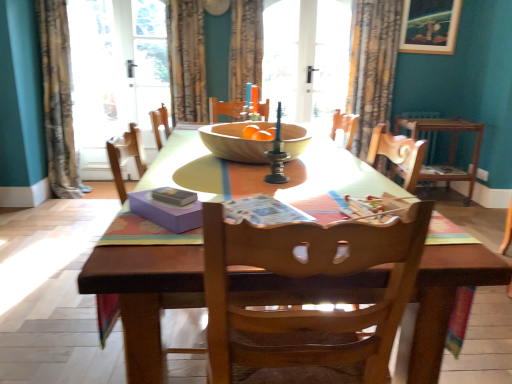
Question: Considering their positions, is patterned fabric curtain at left, which appears as the 1th curtain when viewed from the left, located in front of or behind wooden bowl at center?

Choices:
 (A) behind
 (B) front

Answer: (A)

Question: Is patterned fabric curtain at left, arranged as the fourth curtain when viewed from the right, inside or outside of wooden bowl at center?

Choices:
 (A) outside
 (B) inside

Answer: (A)

Question: Estimate the real-world distances between objects in this image. Which object is closer to the wooden chair at right, the second chair in the left-to-right sequence?

Choices:
 (A) patterned fabric curtain at upper right, which is the 1th curtain from right to left
 (B) white glossy screen door at upper left
 (C) velvet-like brown curtain at upper center, the 3th curtain in the right-to-left sequence
 (D) wooden bowl at center
 (E) wooden table at center

Answer: (A)

Question: Estimate the real-world distances between objects in this image. Which object is farther from the printed paper magazine at center, the 1th magazine from the right?

Choices:
 (A) white glossy screen door at upper left
 (B) textured fabric curtain at upper center, marked as the 2th curtain in a right-to-left arrangement
 (C) wooden picture frame at upper right
 (D) wooden table at center
 (E) wooden bowl at center

Answer: (C)